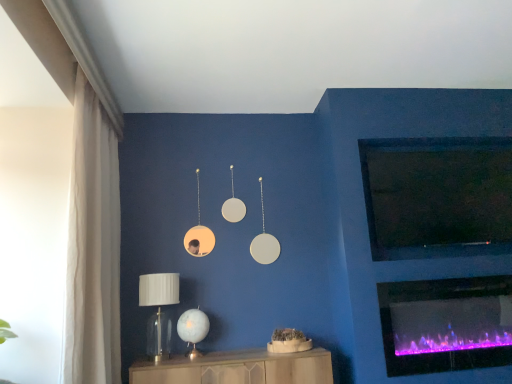
Question: Is wooden cabinet at lower center spatially inside black matte tv at upper right, or outside of it?

Choices:
 (A) outside
 (B) inside

Answer: (A)

Question: Considering the positions of wooden cabinet at lower center and black matte tv at upper right in the image, is wooden cabinet at lower center bigger or smaller than black matte tv at upper right?

Choices:
 (A) big
 (B) small

Answer: (A)

Question: Which of these objects is positioned closest to the wooden cabinet at lower center?

Choices:
 (A) clear glass table lamp at lower left, which is counted as the 2th table lamp, starting from the right
 (B) white sheer curtain at left
 (C) translucent glass table lamp at lower center, the second table lamp from the left
 (D) purple electric fireplace at lower right
 (E) black matte tv at upper right

Answer: (C)

Question: Which object is positioned closest to the white sheer curtain at left?

Choices:
 (A) purple electric fireplace at lower right
 (B) wooden cabinet at lower center
 (C) black matte tv at upper right
 (D) translucent glass table lamp at lower center, the second table lamp from the left
 (E) clear glass table lamp at lower left, which is counted as the 2th table lamp, starting from the right

Answer: (E)